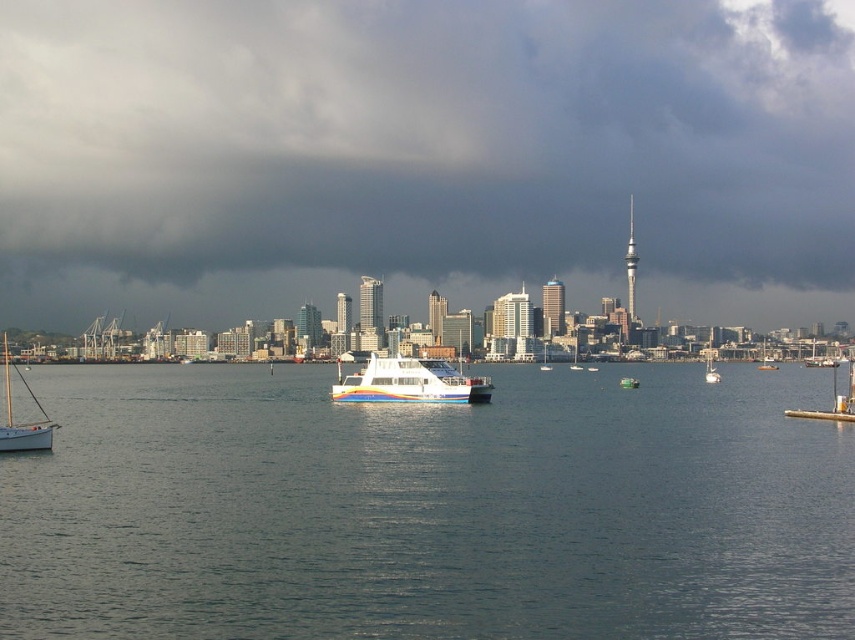
You are a photographer planning to capture the city skyline with both the white wooden sailboat at lower left and the multicolored plastic boat at center in the frame. Based on their positions, which boat should you focus on first to ensure both are visible in the shot?

A: The white wooden sailboat at lower left is positioned on the left side of the multicolored plastic boat at center. To ensure both are visible, focus on the multicolored plastic boat at center first as it is closer to the center of the frame, allowing the sailboat to be included on its left side.

You are a photographer trying to capture the city skyline. You notice two boats in the water below the multicolored plastic boat at center and the metallic silver boat at center. Which boat should you focus on to ensure it appears in front of the city skyline in your photo?

The metallic silver boat at center is positioned under the multicolored plastic boat at center, so focusing on the metallic silver boat at center will place it closer to the camera and in front of the city skyline.

You are a delivery drone that needs to fly from the white wooden sailboat at lower left to the multicolored plastic boat at center. The drone has a maximum flight range of 700 feet. Can it make the trip without needing to recharge?

The white wooden sailboat at lower left is 727.48 feet away from the multicolored plastic boat at center. Since the distance exceeds the drone s 700 feet range, it cannot complete the trip without recharging.